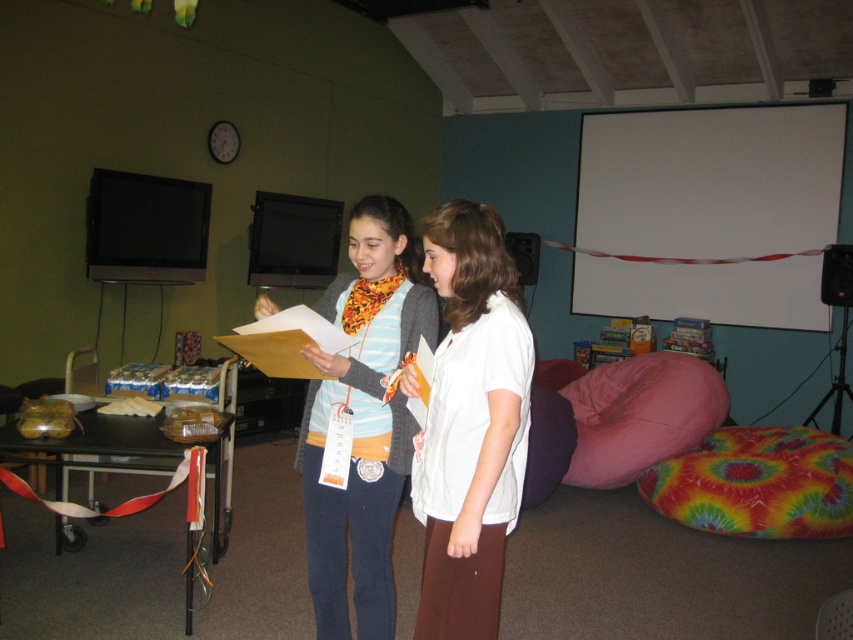
You are organizing a small presentation in the room and need to decide where to place a large projector. The projector requires a surface that is both larger and closer to the audience. Based on the scene, which object should you choose between the white matte projection screen at upper center and the pink fabric bean bag at lower right?

The white matte projection screen at upper center should be chosen because it has a larger size compared to the pink fabric bean bag at lower right, making it more suitable for projecting an image. Additionally, its position at the upper center likely places it closer to the audience for better visibility.

You are planning to set up a presentation in the room. The white matte projection screen at upper center and the pink fabric bean bag at lower right are both in the room. Which object is wider?

The white matte projection screen at upper center is wider than the pink fabric bean bag at lower right.